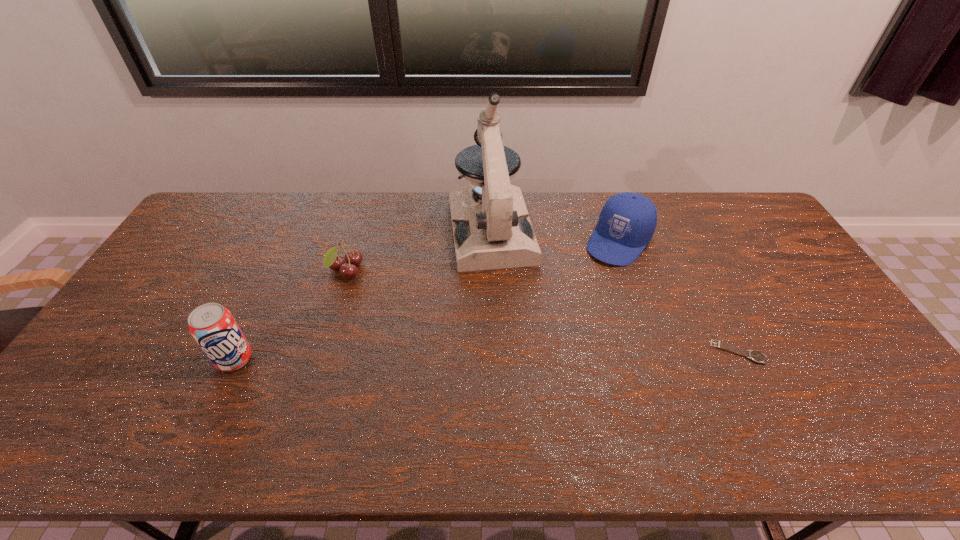
You are a GUI agent. You are given a task and a screenshot of the screen. Output one action in this format:
    pyautogui.click(x=<x>, y=<y>)
    Task: Click on the vacant position located 0.390m on the left of the rightmost object
    Image resolution: width=960 pixels, height=540 pixels.
    Given the screenshot: What is the action you would take?
    pyautogui.click(x=566, y=352)

Identify the location of vacant space located 0.180m on the leaves of the second object from left to right. (401, 302).

Locate an element on the screen. The height and width of the screenshot is (540, 960). free space located 0.230m on the leaves of the second object from left to right is located at coordinates (414, 309).

Locate an element on the screen. vacant space located on the leaves of the second object from left to right is located at coordinates (436, 321).

This screenshot has width=960, height=540. I want to click on free space located 0.230m at the eyepiece of the third object from left to right, so click(511, 329).

Where is `free location located 0.250m at the eyepiece of the third object from left to right`? free location located 0.250m at the eyepiece of the third object from left to right is located at coordinates (512, 335).

Where is `free location located at the eyepiece of the third object from left to right`? free location located at the eyepiece of the third object from left to right is located at coordinates (508, 315).

Locate an element on the screen. vacant region located on the front-facing side of the third tallest object is located at coordinates (598, 271).

Locate an element on the screen. vacant space located on the front-facing side of the third tallest object is located at coordinates (554, 330).

The width and height of the screenshot is (960, 540). What are the coordinates of `vacant space located 0.260m on the front-facing side of the third tallest object` in the screenshot? It's located at (567, 313).